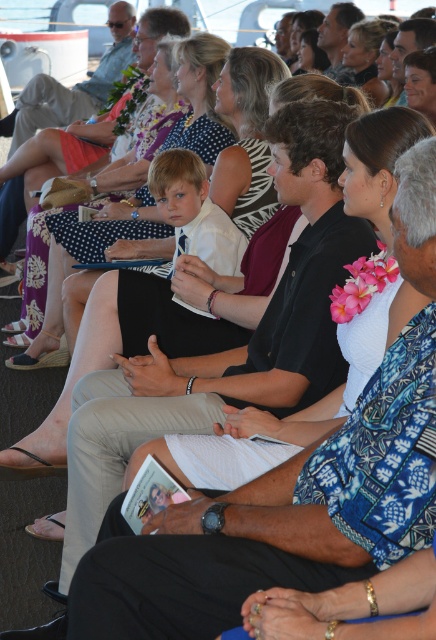
Can you confirm if white floral dress at center is positioned below matte black shirt at center?

Yes.

Between point (200, 64) and point (85, 104), which one is positioned in front?

Point (200, 64)

This screenshot has height=640, width=436. What do you see at coordinates (95, 243) in the screenshot? I see `white floral dress at center` at bounding box center [95, 243].

Find the location of a particular element. The width and height of the screenshot is (436, 640). white floral dress at center is located at coordinates (95, 243).

Based on the photo, does black fabric dress at center have a greater width compared to matte black shirt at center?

No.

Does black fabric dress at center have a lesser width compared to matte black shirt at center?

Yes, black fabric dress at center is thinner than matte black shirt at center.

Does point (408, 516) come farther from viewer compared to point (101, 97)?

No, (408, 516) is in front of (101, 97).

Identify the location of black fabric dress at center. (276, 518).

Is black fabric dress at center smaller than white floral dress at center?

Incorrect, black fabric dress at center is not smaller in size than white floral dress at center.

Who is more forward, (88, 572) or (187, 60)?

Point (88, 572)

Image resolution: width=436 pixels, height=640 pixels. Describe the element at coordinates (276, 518) in the screenshot. I see `black fabric dress at center` at that location.

Find the location of `black fabric dress at center`. black fabric dress at center is located at coordinates (276, 518).